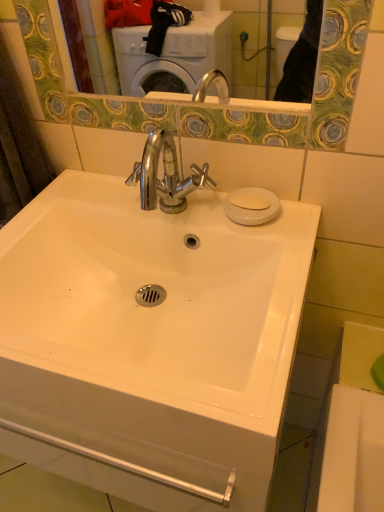
This screenshot has height=512, width=384. In order to click on free space in front of white matte soap at upper right in this screenshot , I will do `click(277, 237)`.